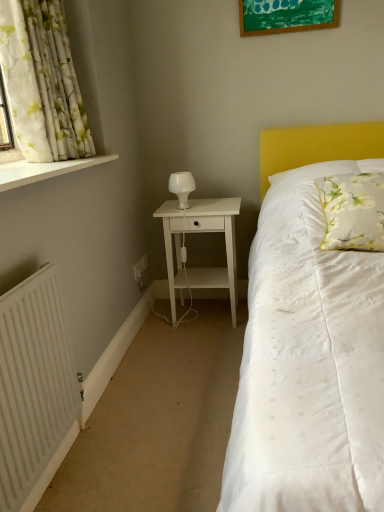
Question: Does white matte nightstand at center have a larger size compared to white glossy window sill at upper left?

Choices:
 (A) no
 (B) yes

Answer: (B)

Question: Does white matte nightstand at center lie behind white glossy window sill at upper left?

Choices:
 (A) no
 (B) yes

Answer: (B)

Question: Is the position of white matte nightstand at center less distant than that of white glossy window sill at upper left?

Choices:
 (A) yes
 (B) no

Answer: (B)

Question: Is white matte nightstand at center smaller than white glossy window sill at upper left?

Choices:
 (A) yes
 (B) no

Answer: (B)

Question: Is white matte nightstand at center at the right side of white glossy window sill at upper left?

Choices:
 (A) yes
 (B) no

Answer: (A)

Question: From a real-world perspective, is white matte nightstand at center above or below white glossy window sill at upper left?

Choices:
 (A) below
 (B) above

Answer: (A)

Question: Looking at the image, does white matte nightstand at center seem bigger or smaller compared to white glossy window sill at upper left?

Choices:
 (A) small
 (B) big

Answer: (B)

Question: Based on their positions, is white matte nightstand at center located to the left or right of white glossy window sill at upper left?

Choices:
 (A) right
 (B) left

Answer: (A)

Question: Considering their positions, is white matte nightstand at center located in front of or behind white glossy window sill at upper left?

Choices:
 (A) behind
 (B) front

Answer: (A)

Question: In terms of size, does white floral fabric curtain at left appear bigger or smaller than white plastic electric outlet at lower left, the first electric outlet when ordered from back to front?

Choices:
 (A) big
 (B) small

Answer: (A)

Question: From a real-world perspective, is white floral fabric curtain at left physically located above or below white plastic electric outlet at lower left, the first electric outlet when ordered from back to front?

Choices:
 (A) below
 (B) above

Answer: (B)

Question: From the image's perspective, is white floral fabric curtain at left located above or below white plastic electric outlet at lower left, positioned as the second electric outlet in front-to-back order?

Choices:
 (A) above
 (B) below

Answer: (A)

Question: Is white floral fabric curtain at left spatially inside white plastic electric outlet at lower left, the first electric outlet when ordered from back to front, or outside of it?

Choices:
 (A) outside
 (B) inside

Answer: (A)

Question: Is point (382, 192) closer or farther from the camera than point (0, 174)?

Choices:
 (A) farther
 (B) closer

Answer: (A)

Question: Is white floral fabric pillow at upper right in front of or behind white glossy window sill at upper left in the image?

Choices:
 (A) behind
 (B) front

Answer: (A)